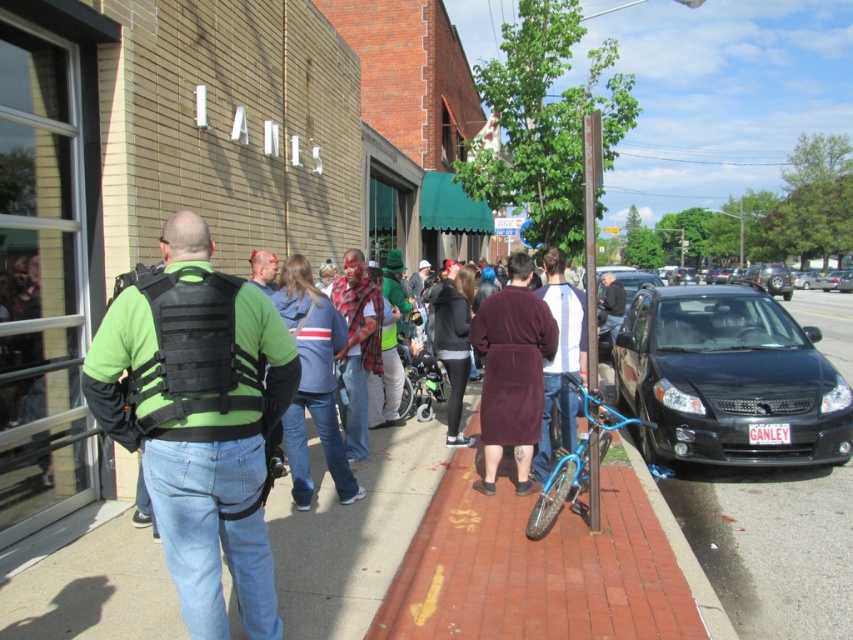
Question: Does white/gray long-sleeve shirt at center have a larger size compared to dark gray hoodie at center?

Choices:
 (A) yes
 (B) no

Answer: (B)

Question: Is the position of maroon bathrobe at center less distant than that of blue denim jeans at center?

Choices:
 (A) no
 (B) yes

Answer: (A)

Question: Among these points, which one is farthest from the camera?

Choices:
 (A) (453, 310)
 (B) (579, 464)

Answer: (A)

Question: Among these objects, which one is nearest to the camera?

Choices:
 (A) green matte vest at center
 (B) maroon bathrobe at center
 (C) shiny blue bicycle at center

Answer: (A)

Question: Which of the following is the farthest from the observer?

Choices:
 (A) (364, 385)
 (B) (276, 321)
 (C) (518, 260)

Answer: (A)

Question: Is the position of maroon bathrobe at center more distant than that of ripped plaid shirt at center?

Choices:
 (A) yes
 (B) no

Answer: (B)